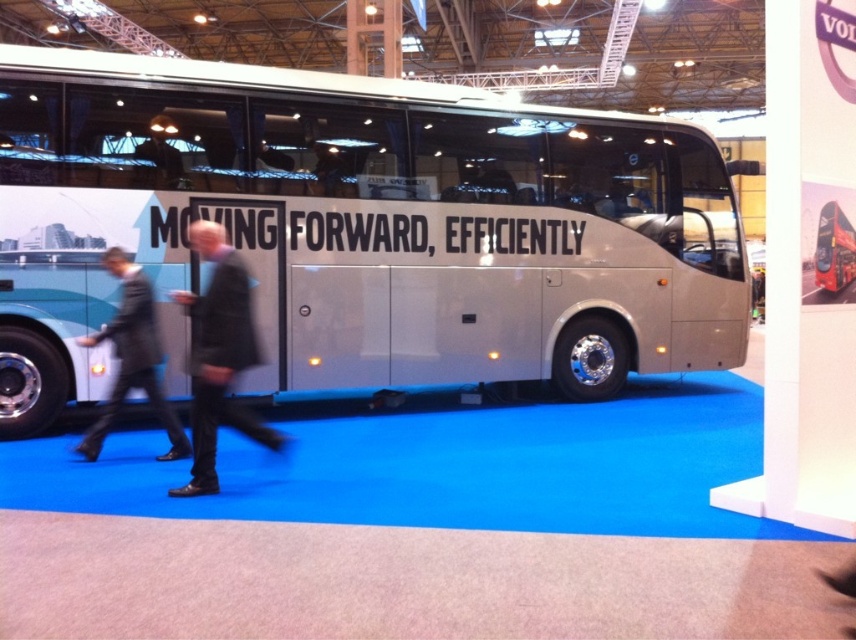
Question: Which object is the farthest from the white metallic bus at center?

Choices:
 (A) dark gray suit at center
 (B) dark gray suit at left

Answer: (A)

Question: Among these objects, which one is farthest from the camera?

Choices:
 (A) dark gray suit at center
 (B) white metallic bus at center

Answer: (B)

Question: Can you confirm if white metallic bus at center is wider than dark gray suit at center?

Choices:
 (A) yes
 (B) no

Answer: (A)

Question: Can you confirm if dark gray suit at center is wider than dark gray suit at left?

Choices:
 (A) no
 (B) yes

Answer: (A)

Question: Can you confirm if white metallic bus at center is positioned above dark gray suit at center?

Choices:
 (A) no
 (B) yes

Answer: (B)

Question: Estimate the real-world distances between objects in this image. Which object is closer to the dark gray suit at center?

Choices:
 (A) dark gray suit at left
 (B) white metallic bus at center

Answer: (A)